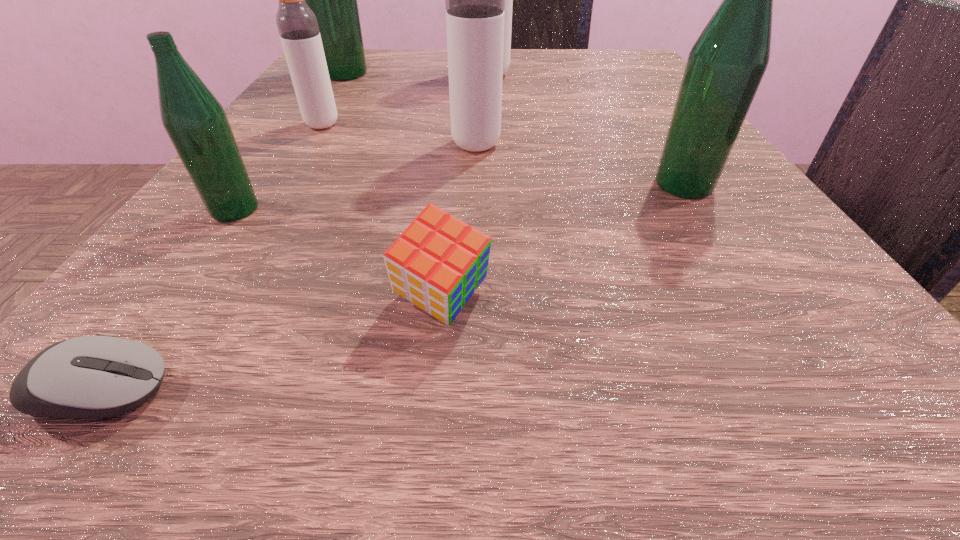
At what (x,y) coordinates should I click in order to perform the action: click on red cube. Please return your answer as a coordinate pair (x, y). The image size is (960, 540). Looking at the image, I should click on (437, 263).

Locate an element on the screen. the shortest object is located at coordinates (100, 376).

Image resolution: width=960 pixels, height=540 pixels. Find the location of `computer equipment`. computer equipment is located at coordinates (100, 376).

Identify the location of free region located on the right of the farthest green bottle. The image size is (960, 540). (450, 73).

Image resolution: width=960 pixels, height=540 pixels. Find the location of `vacant space located on the right of the farthest gray bottle`. vacant space located on the right of the farthest gray bottle is located at coordinates (651, 75).

Identify the location of free space located 0.210m on the back of the fourth farthest object. This screenshot has height=540, width=960. coord(477,82).

Image resolution: width=960 pixels, height=540 pixels. I want to click on free point located 0.140m on the back of the second biggest green bottle, so click(x=644, y=123).

I want to click on vacant space situated on the back of the sixth nearest object, so click(348, 83).

Locate an element on the screen. This screenshot has height=540, width=960. free space located 0.240m on the back of the smallest green bottle is located at coordinates (304, 112).

The width and height of the screenshot is (960, 540). I want to click on vacant space located on the right of the seventh tallest object, so click(614, 301).